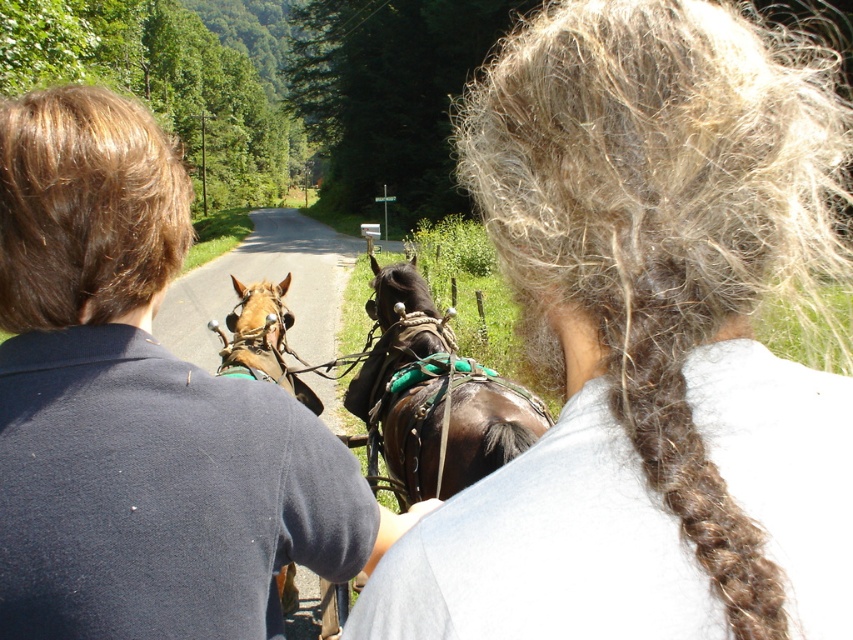
Question: Which of the following is the farthest from the observer?

Choices:
 (A) (688, 289)
 (B) (218, 324)

Answer: (B)

Question: Which is nearer to the shiny brown horse at center?

Choices:
 (A) brown fuzzy hair at upper center
 (B) brown leather coach at center

Answer: (B)

Question: Is shiny brown horse at center to the right of brown leather harness at center from the viewer's perspective?

Choices:
 (A) yes
 (B) no

Answer: (A)

Question: Observing the image, what is the correct spatial positioning of gray textured hair at upper right in reference to brown leather coach at center?

Choices:
 (A) right
 (B) left

Answer: (A)

Question: Which of the following is the farthest from the observer?

Choices:
 (A) (312, 538)
 (B) (776, 429)
 (C) (621, 397)
 (D) (242, 317)

Answer: (D)

Question: Where is gray textured hair at upper right located in relation to brown leather coach at center in the image?

Choices:
 (A) left
 (B) right

Answer: (B)